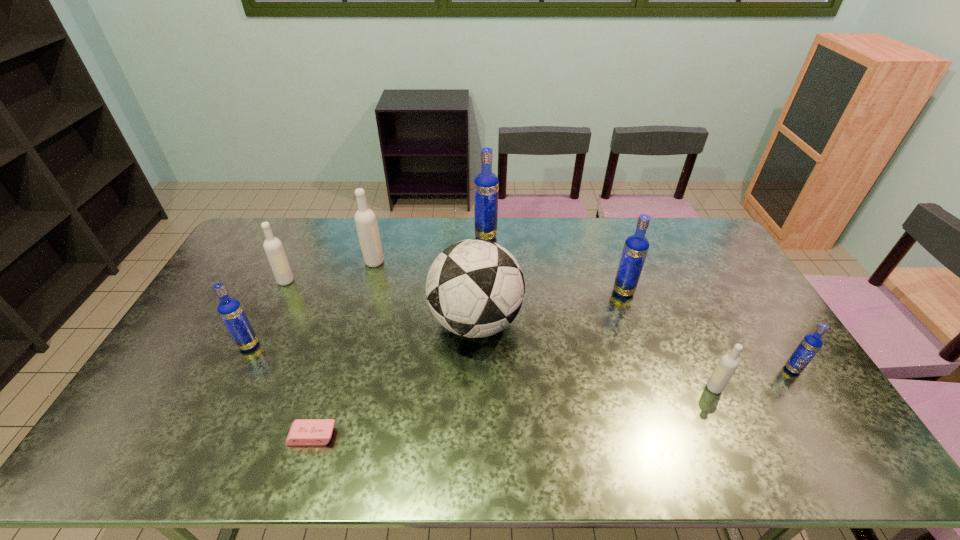
In order to click on the fourth vodka from left to right in this screenshot , I will do 486,184.

At what (x,y) coordinates should I click in order to perform the action: click on the biggest blue vodka. Please return your answer as a coordinate pair (x, y). The height and width of the screenshot is (540, 960). Looking at the image, I should click on (486, 184).

Find the location of a particular element. the second white vodka from left to right is located at coordinates (366, 224).

At what (x,y) coordinates should I click in order to perform the action: click on the farthest white vodka. Please return your answer as a coordinate pair (x, y). This screenshot has height=540, width=960. Looking at the image, I should click on (366, 224).

The width and height of the screenshot is (960, 540). I want to click on the second blue vodka from right to left, so click(636, 246).

Identify the location of the second biggest blue vodka. Image resolution: width=960 pixels, height=540 pixels. (636, 246).

You are a GUI agent. You are given a task and a screenshot of the screen. Output one action in this format:
    pyautogui.click(x=<x>, y=<y>)
    Task: Click on the black soccer ball
    Image resolution: width=960 pixels, height=540 pixels.
    Given the screenshot: What is the action you would take?
    pyautogui.click(x=475, y=288)

Locate an element on the screen. The image size is (960, 540). the third farthest blue vodka is located at coordinates (230, 310).

Image resolution: width=960 pixels, height=540 pixels. In order to click on the leftmost blue vodka in this screenshot , I will do `click(230, 310)`.

Locate an element on the screen. The width and height of the screenshot is (960, 540). the second biggest white vodka is located at coordinates (273, 247).